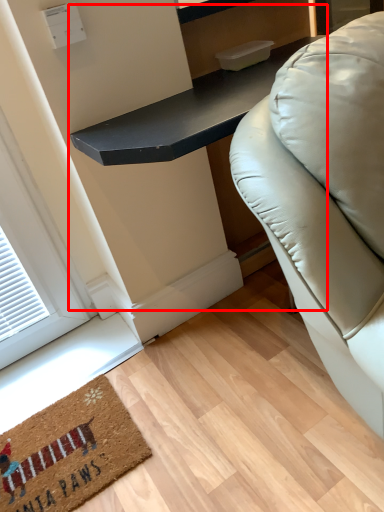
Question: From the image's perspective, where is table (annotated by the red box) located relative to mat?

Choices:
 (A) above
 (B) below

Answer: (A)